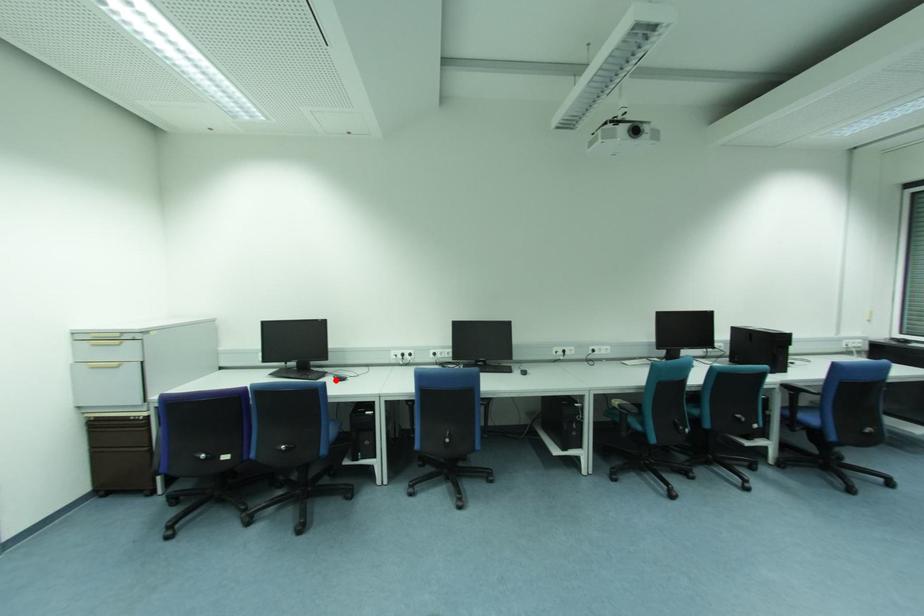
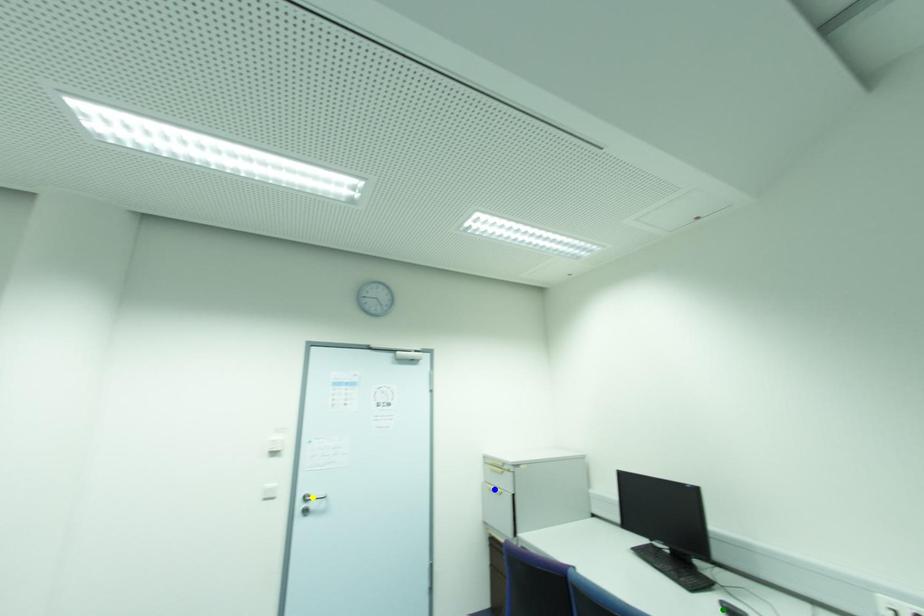
Question: I am providing you with two images of the same scene from different viewpoints. A red point is marked on the first image. You are given multiple points on the second image. Can you choose the point in image 2 that corresponds to the point in image 1?

Choices:
 (A) green point
 (B) yellow point
 (C) blue point

Answer: (A)